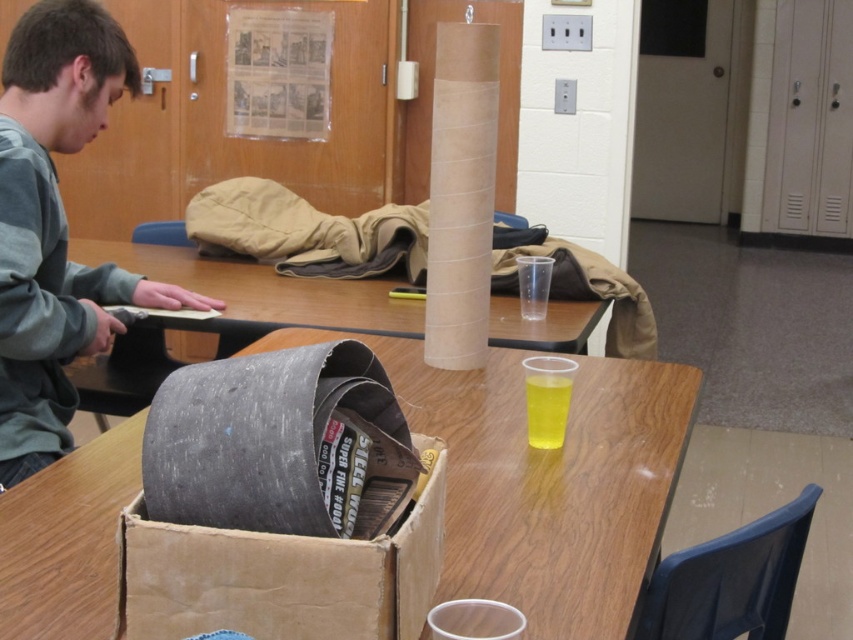
Does gray fabric shirt at left have a smaller size compared to wooden table at center?

Indeed, gray fabric shirt at left has a smaller size compared to wooden table at center.

Is point (109, 45) less distant than point (257, 321)?

Yes, point (109, 45) is closer to viewer.

At what (x,y) coordinates should I click in order to perform the action: click on gray fabric shirt at left. Please return your answer as a coordinate pair (x, y). This screenshot has height=640, width=853. Looking at the image, I should click on (56, 225).

Does cardboard box at center have a greater width compared to brown cardboard box at center?

Correct, the width of cardboard box at center exceeds that of brown cardboard box at center.

Find the location of a particular element. The height and width of the screenshot is (640, 853). cardboard box at center is located at coordinates (544, 480).

The width and height of the screenshot is (853, 640). Find the location of `cardboard box at center`. cardboard box at center is located at coordinates pos(544,480).

Which is in front, point (123, 548) or point (358, 280)?

Point (123, 548)

Is brown cardboard box at center positioned at the back of wooden table at center?

No, it is in front of wooden table at center.

Between point (165, 621) and point (267, 317), which one is positioned behind?

The point (267, 317) is more distant.

The width and height of the screenshot is (853, 640). I want to click on brown cardboard box at center, so click(x=282, y=573).